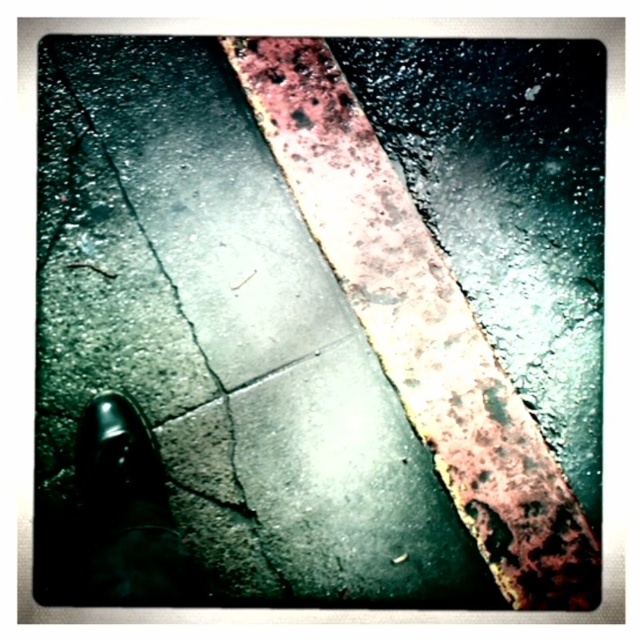
Can you confirm if rusty metal curb at upper center is bigger than shiny black shoe at lower left?

Yes.

Does rusty metal curb at upper center appear on the right side of shiny black shoe at lower left?

Indeed, rusty metal curb at upper center is positioned on the right side of shiny black shoe at lower left.

Which is in front, point (333, 163) or point (129, 504)?

Point (129, 504) is in front.

Identify the location of rusty metal curb at upper center. (420, 324).

Does dark gray concrete crack at lower left have a lesser width compared to rusty metal curb at upper center?

Indeed, dark gray concrete crack at lower left has a lesser width compared to rusty metal curb at upper center.

Which of these two, dark gray concrete crack at lower left or rusty metal curb at upper center, stands shorter?

Standing shorter between the two is dark gray concrete crack at lower left.

Who is more distant from viewer, (172, 502) or (388, 292)?

The point (388, 292) is more distant.

Where is `dark gray concrete crack at lower left`? dark gray concrete crack at lower left is located at coordinates (140, 275).

Which of these two, dark gray concrete crack at lower left or shiny black shoe at lower left, stands taller?

dark gray concrete crack at lower left

You are a GUI agent. You are given a task and a screenshot of the screen. Output one action in this format:
    pyautogui.click(x=<x>, y=<y>)
    Task: Click on the dark gray concrete crack at lower left
    The image size is (640, 640).
    Given the screenshot: What is the action you would take?
    pyautogui.click(x=140, y=275)

Where is `dark gray concrete crack at lower left`? The height and width of the screenshot is (640, 640). dark gray concrete crack at lower left is located at coordinates (140, 275).